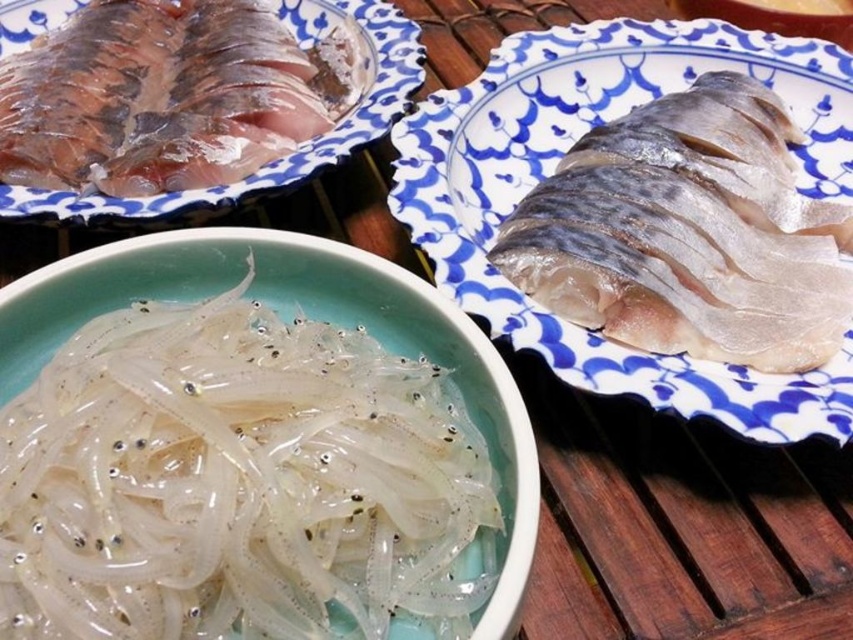
Question: Which of the following is the closest to the observer?

Choices:
 (A) slick silver fish at upper right
 (B) translucent glass bowl at center

Answer: (B)

Question: Among these objects, which one is nearest to the camera?

Choices:
 (A) shiny silver fish at upper left
 (B) translucent glass bowl at center

Answer: (B)

Question: Is translucent glass bowl at center in front of shiny silver fish at upper left?

Choices:
 (A) no
 (B) yes

Answer: (B)

Question: Observing the image, what is the correct spatial positioning of slick silver fish at upper right in reference to shiny silver fish at upper left?

Choices:
 (A) below
 (B) above

Answer: (A)

Question: Can you confirm if slick silver fish at upper right is wider than shiny silver fish at upper left?

Choices:
 (A) yes
 (B) no

Answer: (A)

Question: Which object is positioned farthest from the translucent glass bowl at center?

Choices:
 (A) shiny silver fish at upper left
 (B) slick silver fish at upper right

Answer: (A)